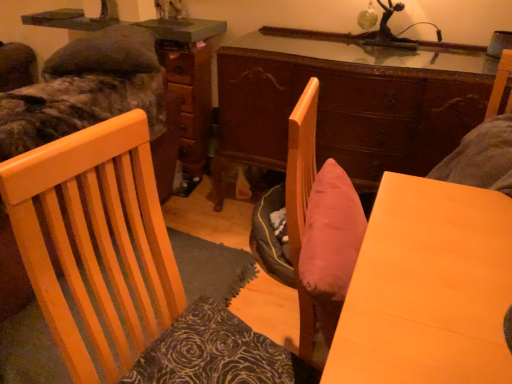
Question: From the image's perspective, is wooden dresser at center over dark brown textured pillow at lower left?

Choices:
 (A) no
 (B) yes

Answer: (B)

Question: Is wooden dresser at center with dark brown textured pillow at lower left?

Choices:
 (A) no
 (B) yes

Answer: (A)

Question: From a real-world perspective, does wooden dresser at center sit lower than dark brown textured pillow at lower left?

Choices:
 (A) no
 (B) yes

Answer: (B)

Question: Does wooden dresser at center contain dark brown textured pillow at lower left?

Choices:
 (A) no
 (B) yes

Answer: (A)

Question: Does wooden dresser at center have a larger size compared to dark brown textured pillow at lower left?

Choices:
 (A) yes
 (B) no

Answer: (A)

Question: In terms of width, does velvet green bed at upper left, arranged as the second bed when viewed from the top, look wider or thinner when compared to wooden table at center?

Choices:
 (A) thin
 (B) wide

Answer: (B)

Question: From the image's perspective, is velvet green bed at upper left, arranged as the second bed when viewed from the top, positioned above or below wooden table at center?

Choices:
 (A) below
 (B) above

Answer: (B)

Question: In the image, is velvet green bed at upper left, arranged as the second bed when viewed from the top, on the left side or the right side of wooden table at center?

Choices:
 (A) left
 (B) right

Answer: (A)

Question: From their relative heights in the image, would you say velvet green bed at upper left, arranged as the second bed when viewed from the top, is taller or shorter than wooden table at center?

Choices:
 (A) short
 (B) tall

Answer: (B)

Question: Is wooden desk at center inside the boundaries of dark brown textured pillow at lower left, or outside?

Choices:
 (A) inside
 (B) outside

Answer: (B)

Question: Is point (457, 119) closer or farther from the camera than point (168, 382)?

Choices:
 (A) closer
 (B) farther

Answer: (B)

Question: In the image, is wooden desk at center positioned in front of or behind dark brown textured pillow at lower left?

Choices:
 (A) front
 (B) behind

Answer: (B)

Question: From their relative heights in the image, would you say wooden desk at center is taller or shorter than dark brown textured pillow at lower left?

Choices:
 (A) short
 (B) tall

Answer: (B)

Question: In terms of width, does camouflage fabric bed at upper left, acting as the second bed starting from the bottom, look wider or thinner when compared to dark brown textured pillow at lower left?

Choices:
 (A) wide
 (B) thin

Answer: (A)

Question: From a real-world perspective, is camouflage fabric bed at upper left, acting as the second bed starting from the bottom, positioned above or below dark brown textured pillow at lower left?

Choices:
 (A) below
 (B) above

Answer: (B)